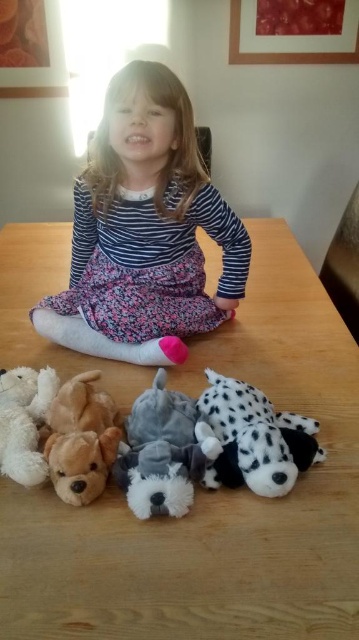
Does striped fabric at center come in front of fluffy gray dog at lower center?

No, it is not.

Which is in front, point (145, 141) or point (132, 422)?

Positioned in front is point (132, 422).

Measure the distance between striped fabric at center and camera.

striped fabric at center and camera are 3.29 feet apart.

The image size is (359, 640). I want to click on striped fabric at center, so click(145, 230).

Who is shorter, spotted plush dog at lower center or fluffy gray dog at lower center?

With less height is spotted plush dog at lower center.

Who is more forward, (257,477) or (143,504)?

Positioned in front is point (143,504).

The width and height of the screenshot is (359, 640). In order to click on spotted plush dog at lower center in this screenshot , I will do `click(254, 438)`.

Which is above, soft plush dogs at lower center or spotted plush dog at lower center?

spotted plush dog at lower center

Does soft plush dogs at lower center have a smaller size compared to spotted plush dog at lower center?

Incorrect, soft plush dogs at lower center is not smaller in size than spotted plush dog at lower center.

Which is behind, point (306, 422) or point (285, 480)?

Positioned behind is point (306, 422).

The height and width of the screenshot is (640, 359). Find the location of `soft plush dogs at lower center`. soft plush dogs at lower center is located at coordinates (188, 449).